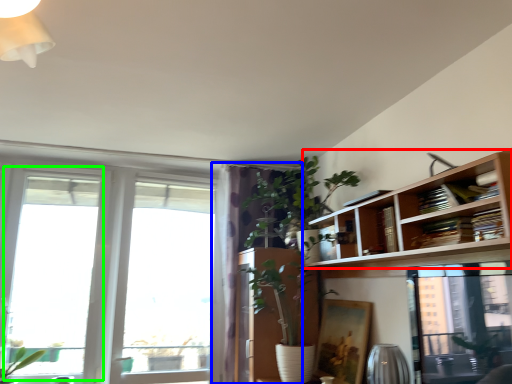
Question: Estimate the real-world distances between objects in this image. Which object is farther from bookshelf (highlighted by a red box), curtain (highlighted by a blue box) or window (highlighted by a green box)?

Choices:
 (A) curtain
 (B) window

Answer: (B)